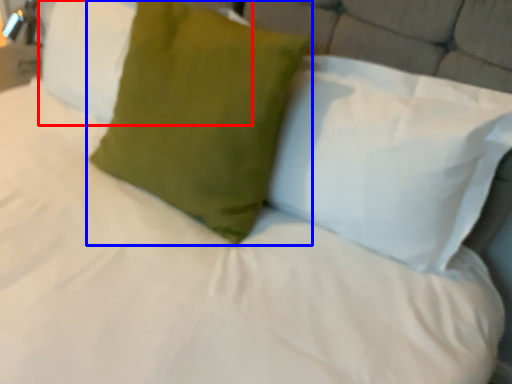
Question: Which object appears closest to the camera in this image, pillow (highlighted by a red box) or pillow (highlighted by a blue box)?

Choices:
 (A) pillow
 (B) pillow

Answer: (B)